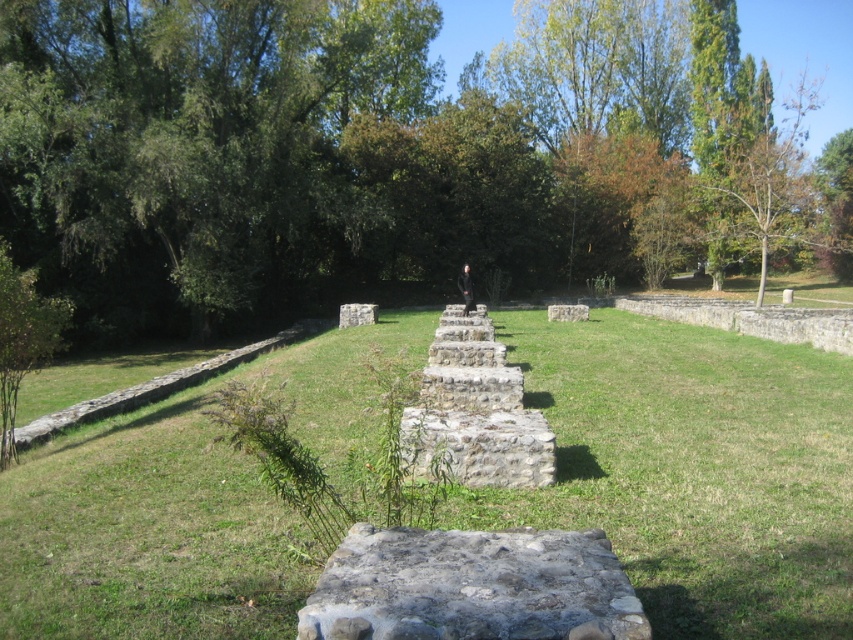
Question: Which point appears farthest from the camera in this image?

Choices:
 (A) (350, 125)
 (B) (611, 618)

Answer: (A)

Question: Which point is farther to the camera?

Choices:
 (A) (456, 435)
 (B) (514, 269)

Answer: (B)

Question: Is rusty stone at center bigger than rustic stone wall at center?

Choices:
 (A) no
 (B) yes

Answer: (A)

Question: Among these objects, which one is nearest to the camera?

Choices:
 (A) green leafy tree at center
 (B) rustic stone wall at center
 (C) gray stone wall at center

Answer: (A)

Question: Is green grassy at center above rustic stone wall at center?

Choices:
 (A) yes
 (B) no

Answer: (B)

Question: Does green leafy tree at center have a lesser width compared to green grassy at center?

Choices:
 (A) no
 (B) yes

Answer: (A)